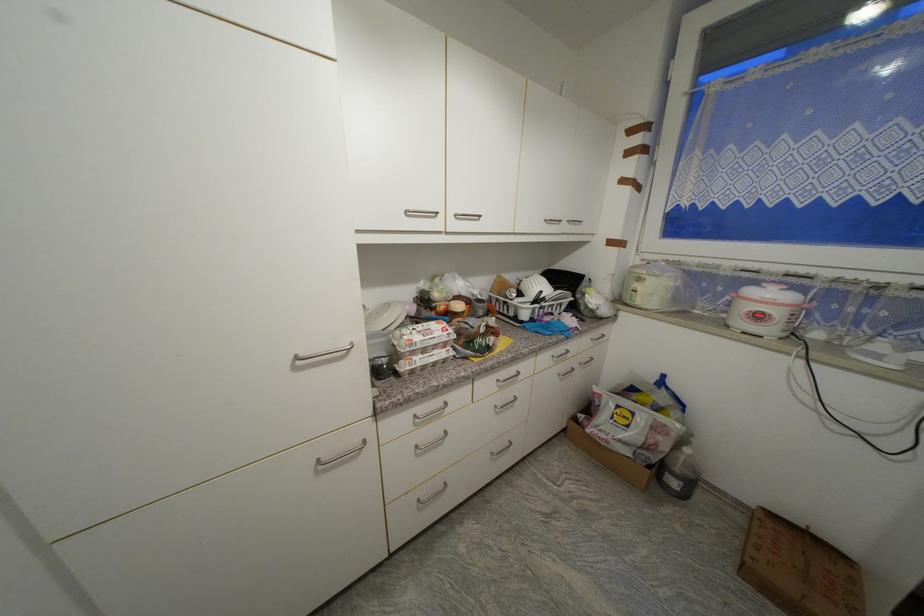
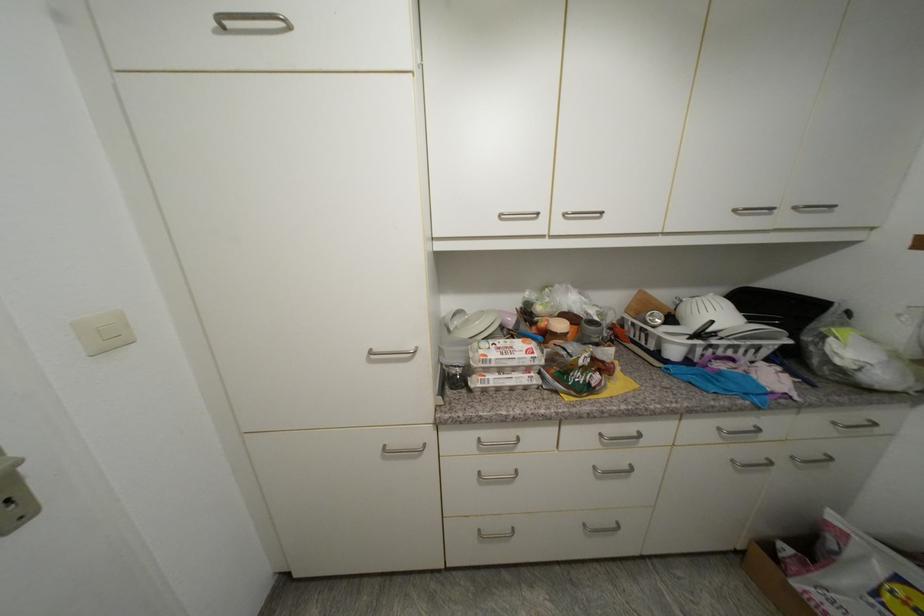
In the second image, find the point that corresponds to (392,365) in the first image.

(466, 376)